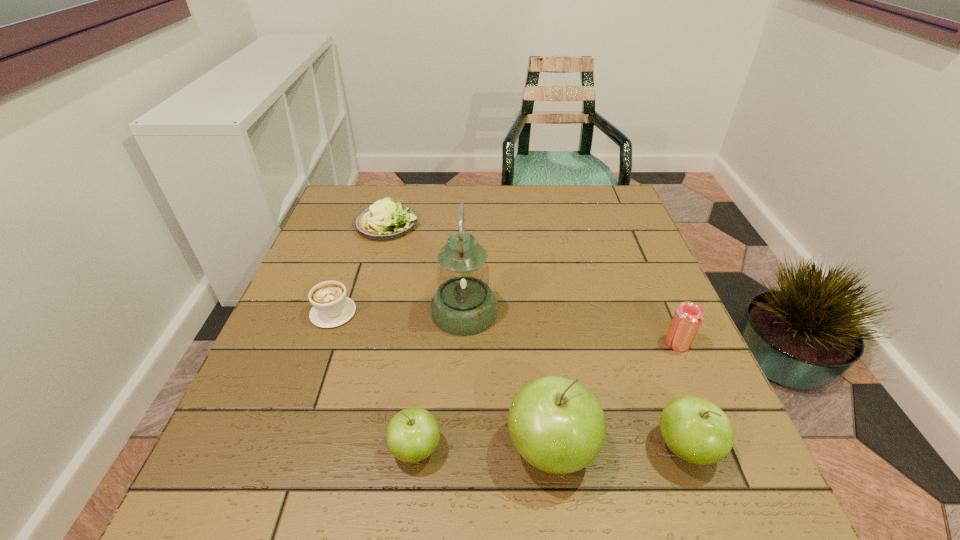
The height and width of the screenshot is (540, 960). In order to click on vacant space situated on the back of the tallest apple in this screenshot , I will do `click(539, 353)`.

Locate an element on the screen. vacant point located 0.250m on the back of the second tallest apple is located at coordinates (638, 319).

The height and width of the screenshot is (540, 960). Find the location of `free region located on the right of the farthest object`. free region located on the right of the farthest object is located at coordinates (467, 225).

Where is `free space located to the right of the cappuccino's handle`? free space located to the right of the cappuccino's handle is located at coordinates (363, 227).

The image size is (960, 540). Identify the location of blank space located to the right of the cappuccino's handle. (364, 225).

Identify the location of vacant space located 0.090m to the right of the cappuccino's handle. (348, 272).

Find the location of a particular element. vacant region located 0.080m on the back of the tallest object is located at coordinates (466, 268).

Find the location of a particular element. The width and height of the screenshot is (960, 540). vacant region located on the left of the beer can is located at coordinates (488, 342).

You are a GUI agent. You are given a task and a screenshot of the screen. Output one action in this format:
    pyautogui.click(x=<x>, y=<y>)
    Task: Click on the object present at the far edge
    The height and width of the screenshot is (540, 960).
    Given the screenshot: What is the action you would take?
    pyautogui.click(x=384, y=220)

The height and width of the screenshot is (540, 960). Find the location of `lettuce present at the left edge`. lettuce present at the left edge is located at coordinates (384, 220).